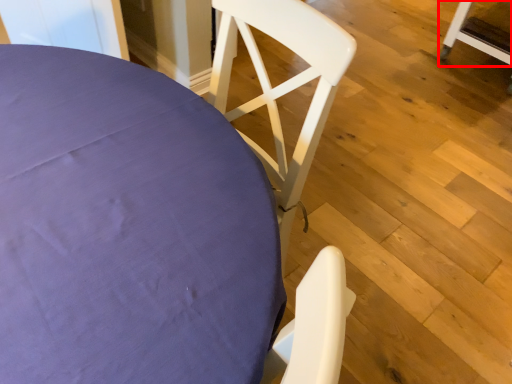
Question: From the image, what is the correct spatial relationship of chair (annotated by the red box) in relation to chair?

Choices:
 (A) right
 (B) left

Answer: (A)